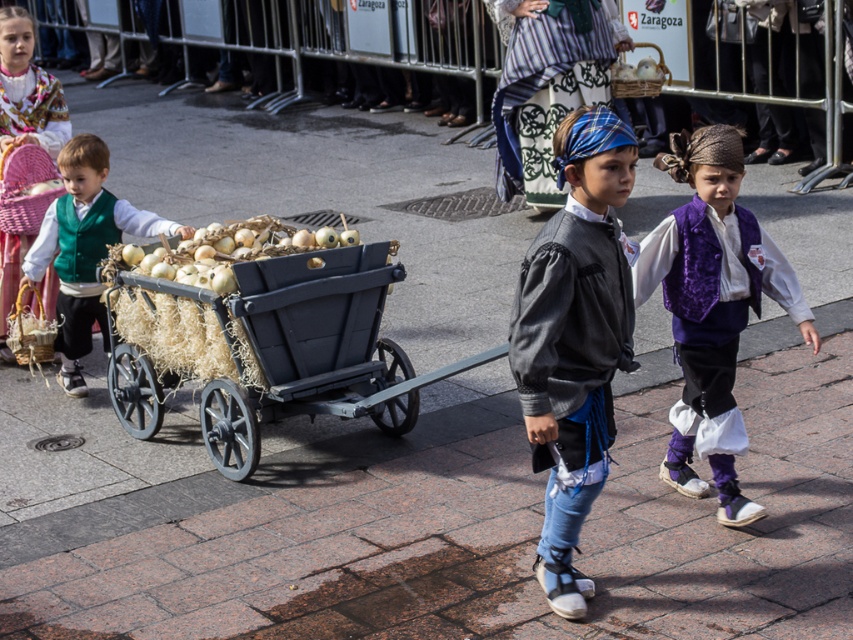
Looking at this image, you are a photographer trying to capture a photo of the black wooden wagon at center and the green velvet vest at left. Which object should you focus on first if you want to ensure both are in the frame without moving the camera?

The black wooden wagon at center is located below the green velvet vest at left, so you should focus on the green velvet vest at left first to ensure it stays within the frame while capturing the wagon below it.

You are a photographer standing at the back of the scene. You want to take a photo of the green velvet vest at left and the matte pink wicker basket at upper left. Can you fit both objects in your camera frame if the maximum distance your camera can capture in a single frame is 1 meter?

The green velvet vest at left is 1.07 meters away from the matte pink wicker basket at upper left. Since the distance exceeds the camera frame limit of 1 meter, you cannot fit both objects in a single frame.